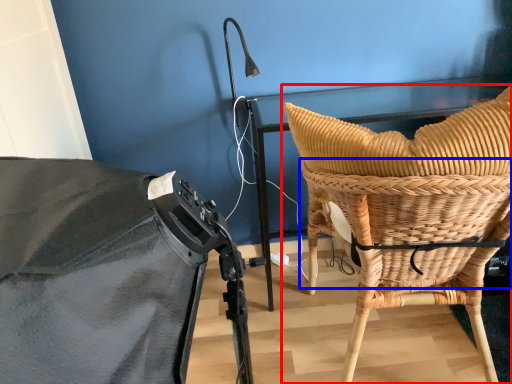
Question: Among these objects, which one is farthest to the camera, chair (highlighted by a red box) or basket (highlighted by a blue box)?

Choices:
 (A) chair
 (B) basket

Answer: (B)